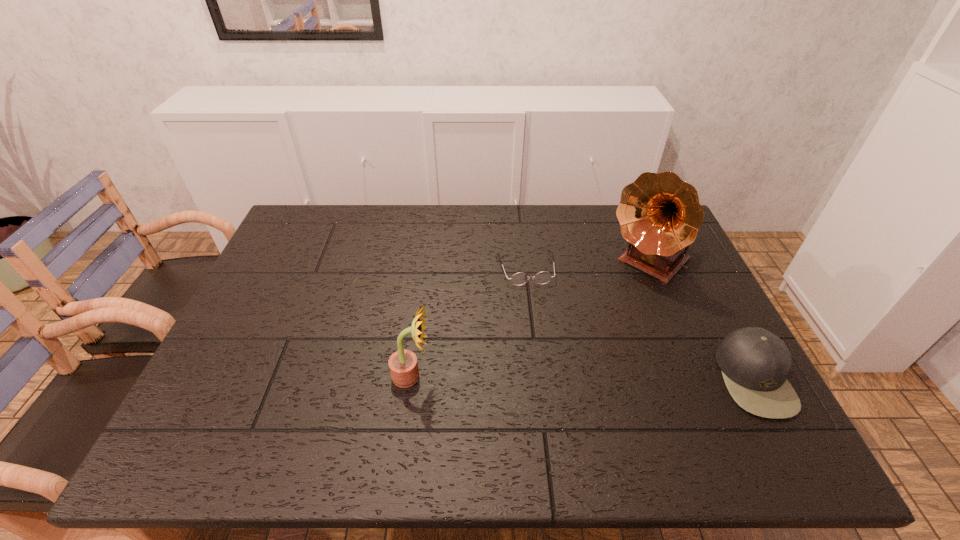
Where is `the leftmost object`? the leftmost object is located at coordinates (403, 365).

Image resolution: width=960 pixels, height=540 pixels. In order to click on sunflower in this screenshot , I will do `click(403, 365)`.

I want to click on the third tallest object, so click(x=754, y=362).

At what (x,y) coordinates should I click in order to perform the action: click on the tallest object. Please return your answer as a coordinate pair (x, y). Looking at the image, I should click on (660, 215).

This screenshot has width=960, height=540. I want to click on the shortest object, so click(x=543, y=277).

Find the location of `the second object from left to right`. the second object from left to right is located at coordinates (543, 277).

At what (x,y) coordinates should I click in order to perform the action: click on vacant area situated on the face of the second tallest object. Please return your answer as a coordinate pair (x, y). Image resolution: width=960 pixels, height=540 pixels. Looking at the image, I should click on (452, 376).

Where is `vacant space positioned on the brim of the cap`? The height and width of the screenshot is (540, 960). vacant space positioned on the brim of the cap is located at coordinates (625, 378).

I want to click on vacant space positioned 0.270m on the brim of the cap, so click(x=609, y=378).

This screenshot has width=960, height=540. I want to click on vacant space located on the brim of the cap, so click(x=655, y=378).